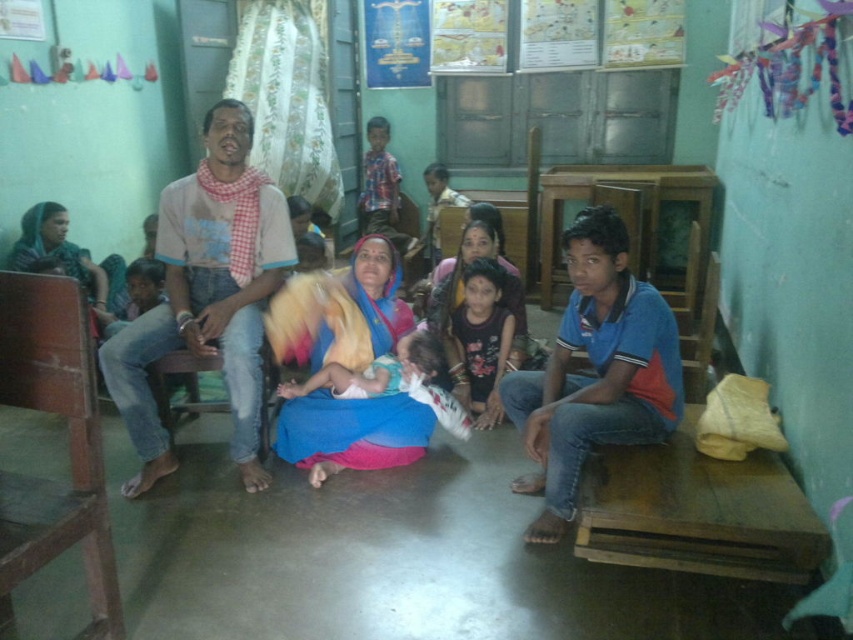
Question: Among these points, which one is farthest from the camera?

Choices:
 (A) (477, 420)
 (B) (627, 388)

Answer: (A)

Question: Which of the following is the farthest from the observer?

Choices:
 (A) light brown cotton shirt at left
 (B) dark blue fabric dress at center

Answer: (B)

Question: Does light brown cotton shirt at left lie in front of dark blue fabric dress at center?

Choices:
 (A) yes
 (B) no

Answer: (A)

Question: Among these objects, which one is farthest from the camera?

Choices:
 (A) blue cotton shirt at right
 (B) blue fabric dress at center

Answer: (B)

Question: In this image, where is blue fabric dress at center located relative to light brown cotton shirt at left?

Choices:
 (A) above
 (B) below

Answer: (B)

Question: Observing the image, what is the correct spatial positioning of blue fabric dress at center in reference to dark blue fabric dress at center?

Choices:
 (A) below
 (B) above

Answer: (B)